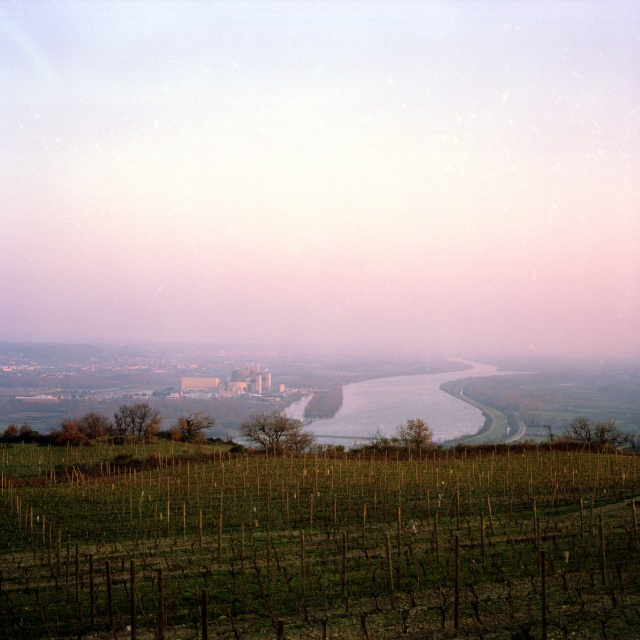
Which is in front, point (106, 628) or point (477, 420)?

Positioned in front is point (106, 628).

Looking at this image, can you confirm if green grassy vineyard at lower center is smaller than gray/smooth river at center?

No, green grassy vineyard at lower center is not smaller than gray/smooth river at center.

What do you see at coordinates (320, 544) in the screenshot? I see `green grassy vineyard at lower center` at bounding box center [320, 544].

Where is `green grassy vineyard at lower center`? green grassy vineyard at lower center is located at coordinates (320, 544).